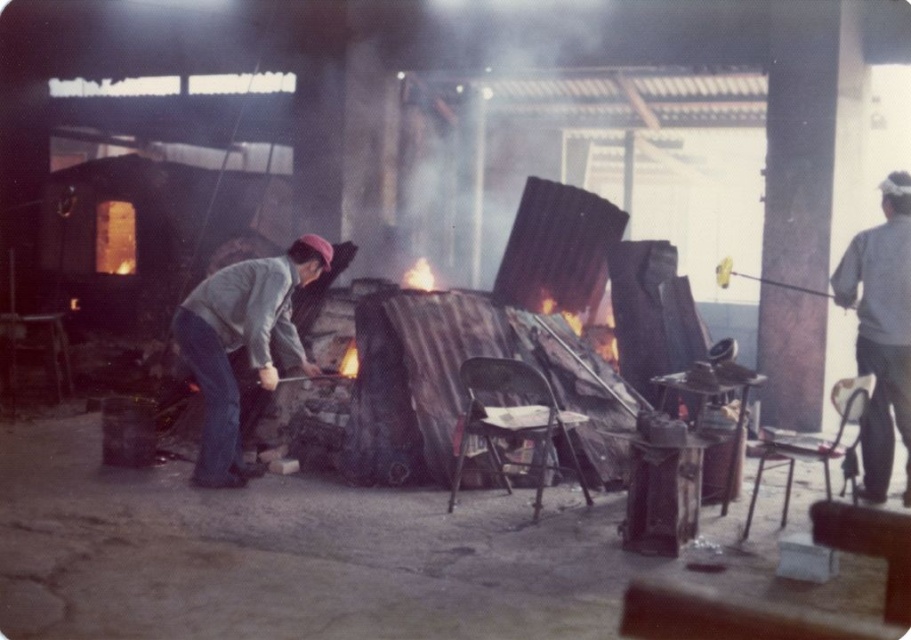
Question: Does gray fabric jacket at center appear on the right side of gray fabric shirt at right?

Choices:
 (A) yes
 (B) no

Answer: (B)

Question: Does gray fabric jacket at center lie in front of gray fabric shirt at right?

Choices:
 (A) no
 (B) yes

Answer: (A)

Question: Among these points, which one is nearest to the camera?

Choices:
 (A) (275, 275)
 (B) (879, 372)

Answer: (A)

Question: Can you confirm if gray fabric jacket at center is positioned to the left of gray fabric shirt at right?

Choices:
 (A) no
 (B) yes

Answer: (B)

Question: Which point is closer to the camera?

Choices:
 (A) (898, 358)
 (B) (274, 316)

Answer: (A)